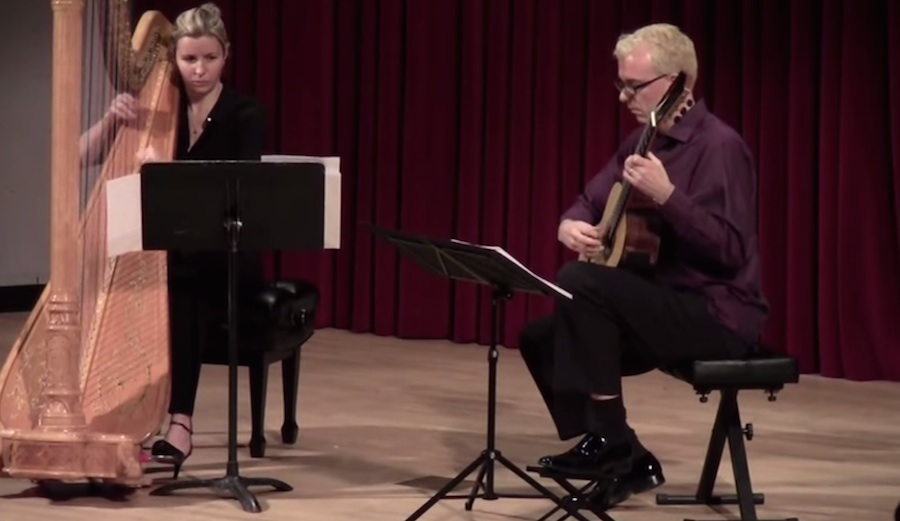
This screenshot has width=900, height=521. Identify the location of beige wall. (24, 90).